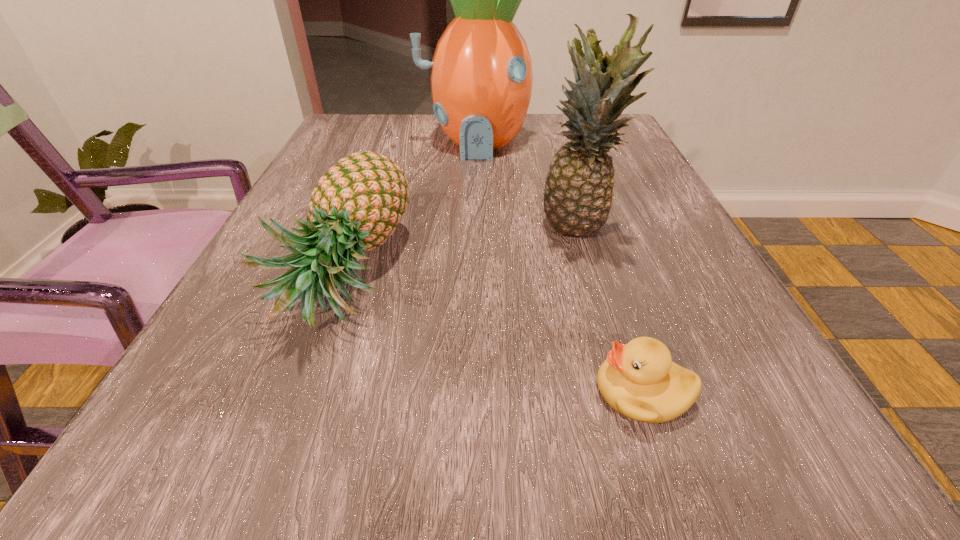
Where is `free space between the third tallest object and the farthest object`? The width and height of the screenshot is (960, 540). free space between the third tallest object and the farthest object is located at coordinates (410, 207).

Identify which object is the closest to the shortest pineapple. Please provide its 2D coordinates. Your answer should be formatted as a tuple, i.e. [(x, y)], where the tuple contains the x and y coordinates of a point satisfying the conditions above.

[(481, 73)]

Locate which object ranks in proximity to the duckling. Please provide its 2D coordinates. Your answer should be formatted as a tuple, i.e. [(x, y)], where the tuple contains the x and y coordinates of a point satisfying the conditions above.

[(578, 193)]

Where is `pineapple that is the third nearest to the duckling`? This screenshot has height=540, width=960. pineapple that is the third nearest to the duckling is located at coordinates (481, 73).

Select which pineapple is the second closest to the third shortest object. Please provide its 2D coordinates. Your answer should be formatted as a tuple, i.e. [(x, y)], where the tuple contains the x and y coordinates of a point satisfying the conditions above.

[(359, 202)]

The image size is (960, 540). Identify the location of free region that satisfies the following two spatial constraints: 1. at the entrance of the tallest object; 2. on the left side of the second tallest pineapple. (474, 228).

The image size is (960, 540). What are the coordinates of `vacant position in the image that satisfies the following two spatial constraints: 1. at the entrance of the third shortest object; 2. on the right side of the farthest pineapple` in the screenshot? It's located at (474, 228).

Identify the location of free spot that satisfies the following two spatial constraints: 1. at the entrance of the tallest pineapple; 2. on the left side of the third shortest object. The image size is (960, 540). (474, 228).

The width and height of the screenshot is (960, 540). In order to click on free space that satisfies the following two spatial constraints: 1. at the entrance of the tallest pineapple; 2. on the left side of the second tallest pineapple in this screenshot , I will do `click(474, 228)`.

The image size is (960, 540). Find the location of `blank space that satisfies the following two spatial constraints: 1. at the entrance of the farthest pineapple; 2. on the right side of the second shortest pineapple`. blank space that satisfies the following two spatial constraints: 1. at the entrance of the farthest pineapple; 2. on the right side of the second shortest pineapple is located at coordinates (474, 228).